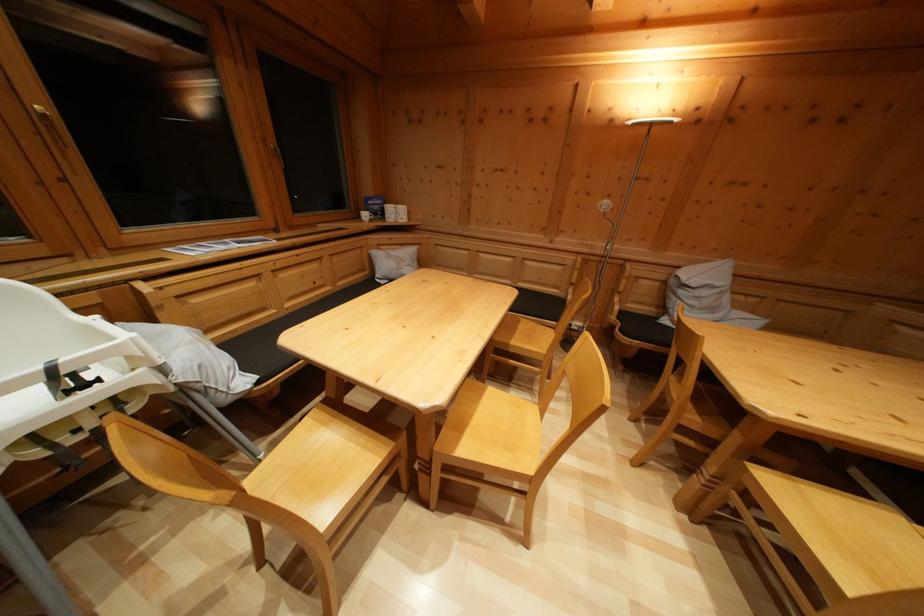
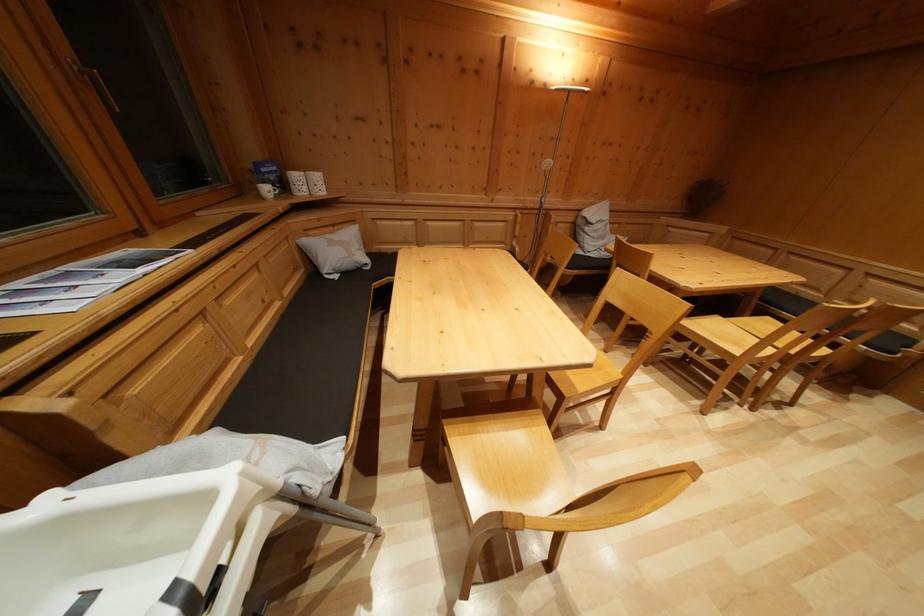
Where in the second image is the point corresponding to (x=103, y=323) from the first image?

(56, 503)